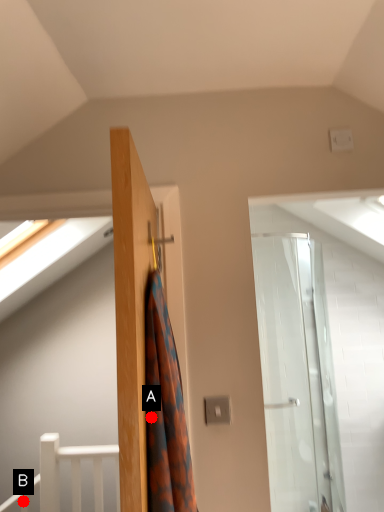
Question: Two points are circled on the image, labeled by A and B beside each circle. Which point appears farthest from the camera in this image?

Choices:
 (A) A is further
 (B) B is further

Answer: (B)